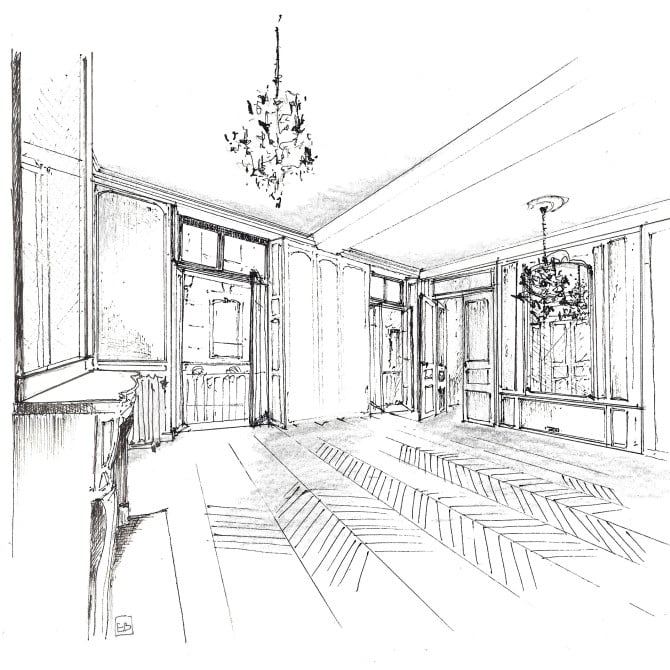
The height and width of the screenshot is (670, 670). I want to click on chandeliers, so click(551, 295), click(281, 145).